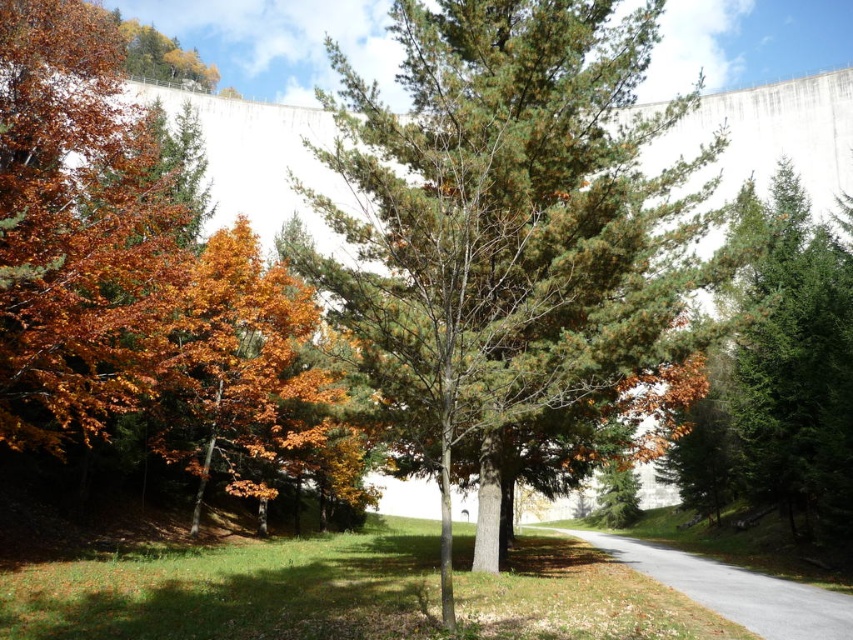
Does orange-brown foliage at left appear under orange matte tree at left?

Actually, orange-brown foliage at left is above orange matte tree at left.

Can you confirm if orange-brown foliage at left is positioned to the right of orange matte tree at left?

No, orange-brown foliage at left is not to the right of orange matte tree at left.

Between point (74, 209) and point (207, 248), which one is positioned behind?

Point (207, 248)

The height and width of the screenshot is (640, 853). I want to click on orange-brown foliage at left, so click(x=80, y=230).

Image resolution: width=853 pixels, height=640 pixels. Describe the element at coordinates (236, 365) in the screenshot. I see `orange matte tree at left` at that location.

Which is behind, point (194, 524) or point (828, 608)?

Positioned behind is point (194, 524).

What are the coordinates of `orange matte tree at left` in the screenshot? It's located at (236, 365).

In the scene shown: Who is lower down, green needle-like at center or orange matte tree at left?

Positioned lower is orange matte tree at left.

The width and height of the screenshot is (853, 640). Find the location of `green needle-like at center`. green needle-like at center is located at coordinates 509,221.